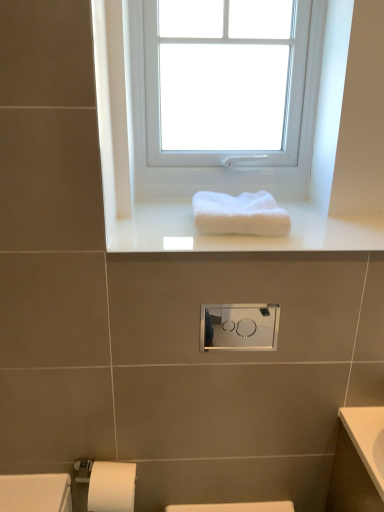
Question: Is white glossy towel at upper center thinner than white plastic window at upper center?

Choices:
 (A) yes
 (B) no

Answer: (B)

Question: Is white glossy towel at upper center to the right of white plastic window at upper center from the viewer's perspective?

Choices:
 (A) no
 (B) yes

Answer: (B)

Question: Can you confirm if white glossy towel at upper center is bigger than white plastic window at upper center?

Choices:
 (A) no
 (B) yes

Answer: (A)

Question: Is white glossy towel at upper center not close to white plastic window at upper center?

Choices:
 (A) yes
 (B) no

Answer: (B)

Question: Can you confirm if white glossy towel at upper center is wider than white plastic window at upper center?

Choices:
 (A) yes
 (B) no

Answer: (A)

Question: Does white glossy towel at upper center lie in front of white plastic window at upper center?

Choices:
 (A) yes
 (B) no

Answer: (A)

Question: Is white fluffy towel at center further to the viewer compared to satin silver medicine cabinet at center?

Choices:
 (A) no
 (B) yes

Answer: (A)

Question: From the image's perspective, is white fluffy towel at center on top of satin silver medicine cabinet at center?

Choices:
 (A) no
 (B) yes

Answer: (B)

Question: Considering the relative positions of white fluffy towel at center and satin silver medicine cabinet at center in the image provided, is white fluffy towel at center to the left of satin silver medicine cabinet at center from the viewer's perspective?

Choices:
 (A) yes
 (B) no

Answer: (B)

Question: Can you confirm if white fluffy towel at center is taller than satin silver medicine cabinet at center?

Choices:
 (A) no
 (B) yes

Answer: (A)

Question: Does white fluffy towel at center have a smaller size compared to satin silver medicine cabinet at center?

Choices:
 (A) no
 (B) yes

Answer: (A)

Question: Is there a large distance between white fluffy towel at center and satin silver medicine cabinet at center?

Choices:
 (A) yes
 (B) no

Answer: (B)

Question: Is the depth of white plastic window at upper center greater than that of satin silver medicine cabinet at center?

Choices:
 (A) no
 (B) yes

Answer: (B)